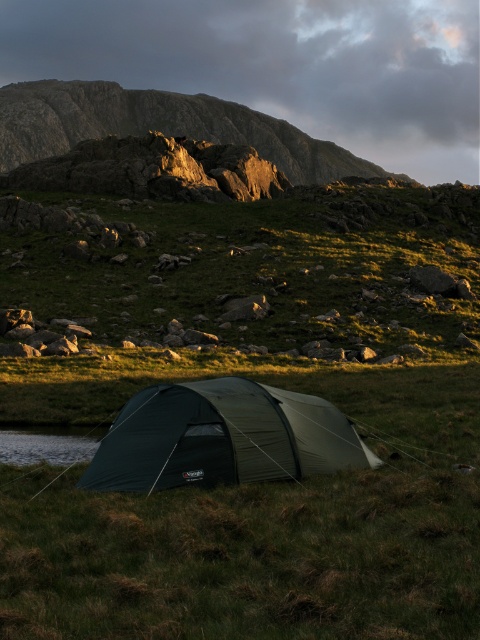
Who is positioned more to the right, green fabric tent at center or rugged stone hillside at upper center?

From the viewer's perspective, green fabric tent at center appears more on the right side.

You are a GUI agent. You are given a task and a screenshot of the screen. Output one action in this format:
    pyautogui.click(x=<x>, y=<y>)
    Task: Click on the green fabric tent at center
    
    Given the screenshot: What is the action you would take?
    pyautogui.click(x=222, y=436)